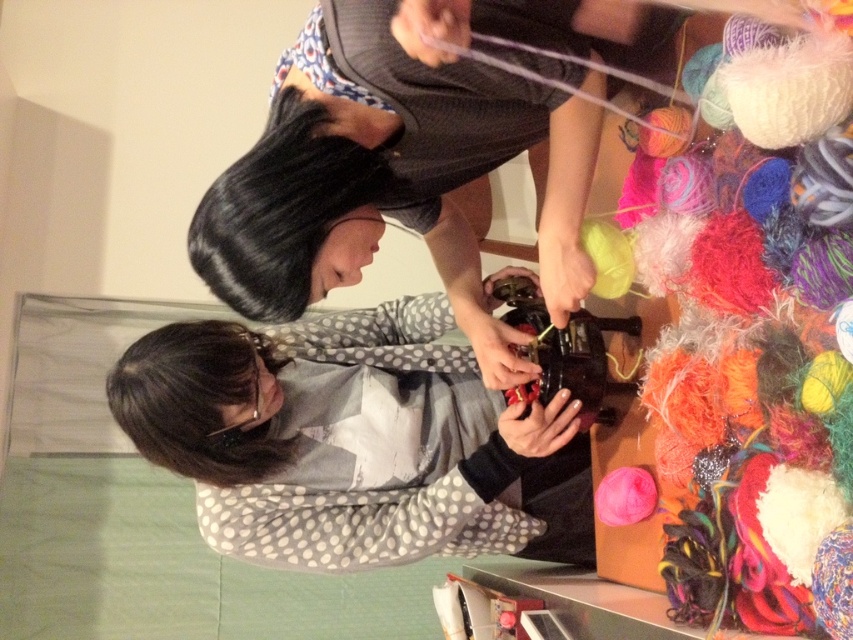
Who is shorter, matte gray sweater at center or black silky hair at upper center?

With less height is black silky hair at upper center.

Is matte gray sweater at center smaller than black silky hair at upper center?

No.

Who is more forward, (x=392, y=68) or (x=239, y=314)?

Point (x=392, y=68) is more forward.

The height and width of the screenshot is (640, 853). In order to click on matte gray sweater at center in this screenshot , I will do `click(416, 154)`.

What do you see at coordinates (416, 154) in the screenshot?
I see `matte gray sweater at center` at bounding box center [416, 154].

Who is higher up, matte gray sweater at center or dark brown hair at lower left?

matte gray sweater at center

Does point (355, 120) lie in front of point (219, 468)?

Yes, point (355, 120) is closer to viewer.

Locate an element on the screen. matte gray sweater at center is located at coordinates (416, 154).

Between matte gray sweater at center and polka dot fabric shirt at center, which one has more height?

matte gray sweater at center

Locate an element on the screen. This screenshot has width=853, height=640. matte gray sweater at center is located at coordinates pos(416,154).